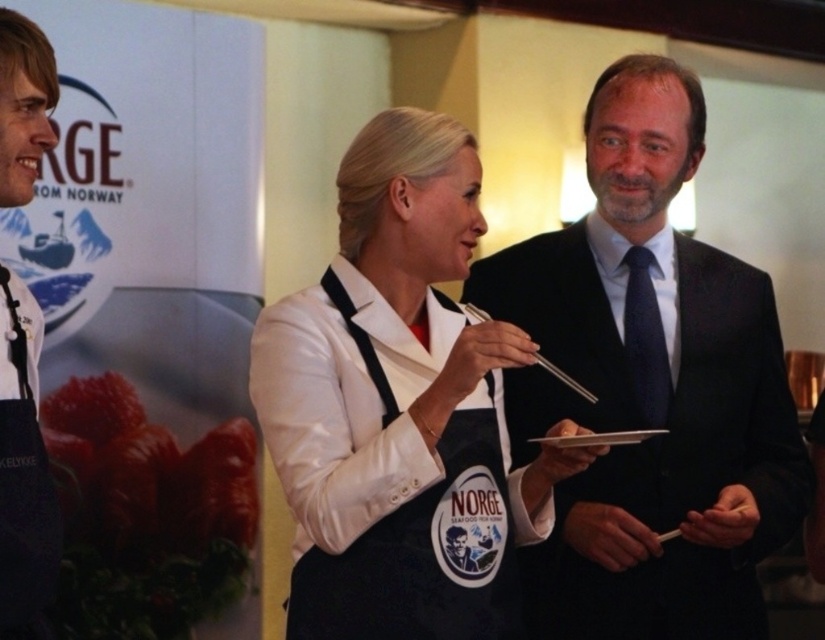
Based on the photo, based on the coordinates provided in the scene description, where exactly is the dark suit at center located?

The dark suit at center is located at point coordinates of 0.606 on the x axis and 0.789 on the y axis.

You are a photographer at the event and want to capture a clear shot of the white satin apron at center and the black fabric apron at center. Which apron will appear larger in the photo?

The white satin apron at center will appear larger in the photo because it is closer to the viewer than the black fabric apron at center.

In the scene shown: You are standing in the scene and want to move from the point at coordinates point (484,360) to the point at coordinates point (318,596). Which direction should you face to move towards the second point?

To move from point (484,360) to point (318,596), you should face towards the lower right direction since point (318,596) is located to the lower right of point (484,360).